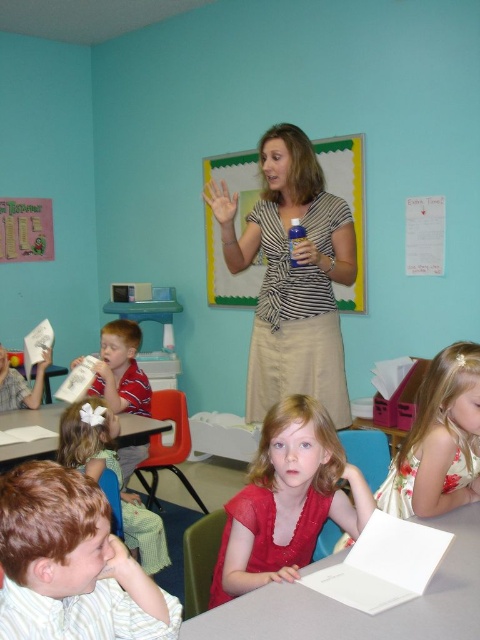
In the classroom scene, there is a point located at coordinates (115,474). According to the image, where is this point situated? Please specify the object it belongs to.

The point at (115,474) is located on the light brown hair at center.

You are a teacher in the classroom. You need to determine if the matte red dress at center can be placed on the smooth skin hand at center without overlapping. Can it fit?

The matte red dress at center is wider than the smooth skin hand at center, so it cannot fit without overlapping.

You are standing in the classroom and want to reach the point at coordinates point (288, 570). If you are 1.68 meters tall, can you step on a chair that is 0.5 meters high to reach it?

The point (288, 570) is 1.32 meters from the viewer. Since the chair adds 0.5 meters to your height, your total reach would be 1.68 meters plus 0.5 meters equals 2.18 meters. Since 2.18 meters is greater than 1.32 meters, you can reach the point (288, 570).